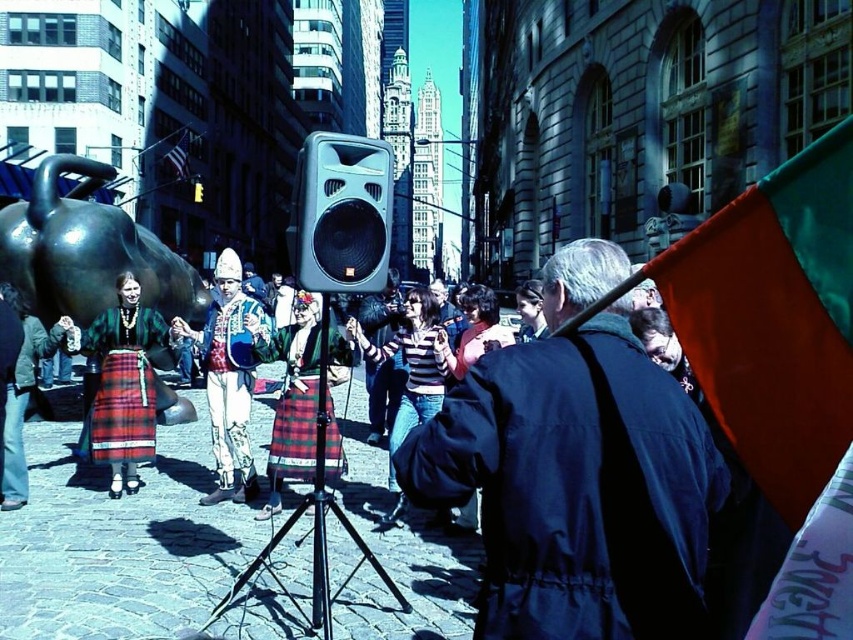
Is matte black speaker at center smaller than embroidered fabric outfit at center?

Yes.

Which is more to the right, matte black speaker at center or embroidered fabric outfit at center?

matte black speaker at center is more to the right.

Does point (329, 259) lie in front of point (242, 477)?

Yes, point (329, 259) is in front of point (242, 477).

The image size is (853, 640). Identify the location of matte black speaker at center. (341, 212).

Is orange fabric flag at center right below plaid skirt at center?

Actually, orange fabric flag at center right is above plaid skirt at center.

Does orange fabric flag at center right have a greater width compared to plaid skirt at center?

Incorrect, orange fabric flag at center right's width does not surpass plaid skirt at center's.

Who is more distant from viewer, (764, 387) or (303, 477)?

The point (303, 477) is behind.

Locate an element on the screen. The width and height of the screenshot is (853, 640). orange fabric flag at center right is located at coordinates tap(775, 320).

Which is in front, point (358, 276) or point (764, 618)?

Positioned in front is point (764, 618).

Does point (340, 170) lie behind point (811, 637)?

Yes, point (340, 170) is behind point (811, 637).

You are a GUI agent. You are given a task and a screenshot of the screen. Output one action in this format:
    pyautogui.click(x=<x>, y=<y>)
    Task: Click on the matte black speaker at center
    Image resolution: width=853 pixels, height=640 pixels.
    Given the screenshot: What is the action you would take?
    pyautogui.click(x=341, y=212)